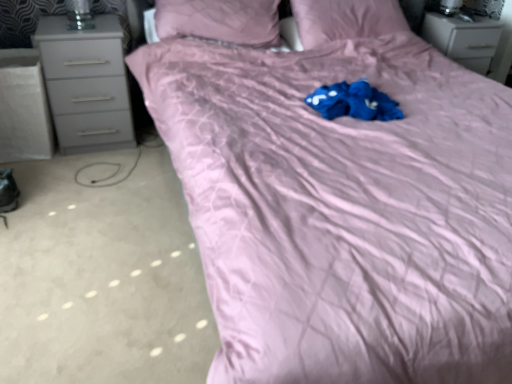
I want to click on free location in front of gray matte chest of drawers at left, acting as the second chest of drawers starting from the right, so click(x=66, y=172).